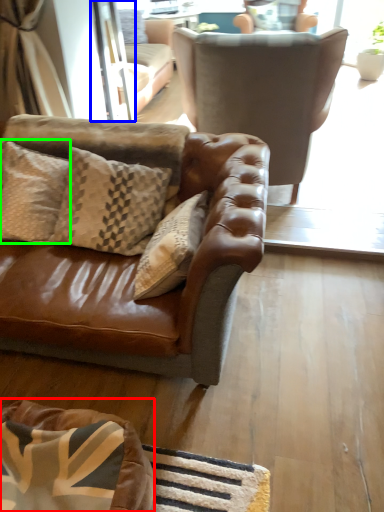
Question: Based on their relative distances, which object is farther from dog bed (highlighted by a red box)? Choose from screen door (highlighted by a blue box) and pillow (highlighted by a green box).

Choices:
 (A) screen door
 (B) pillow

Answer: (A)